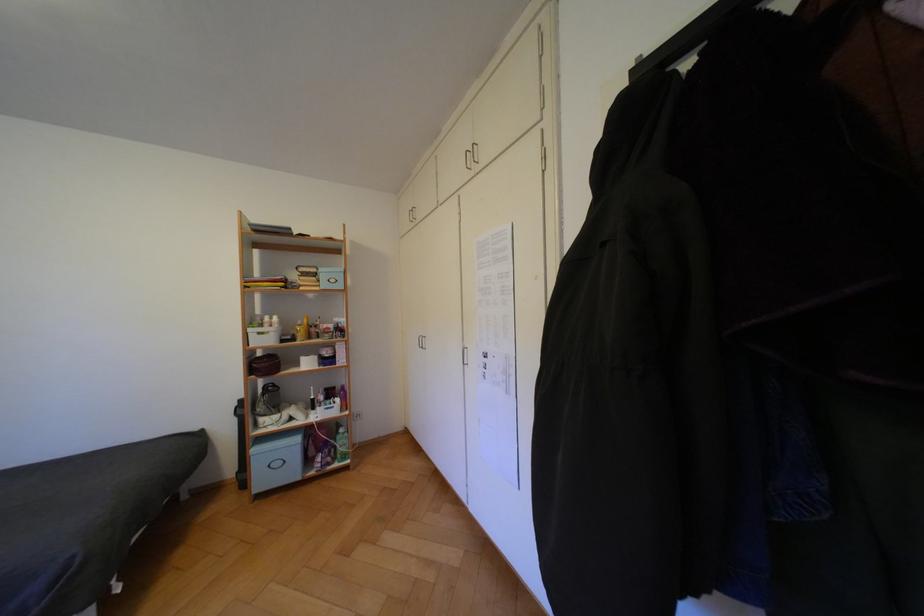
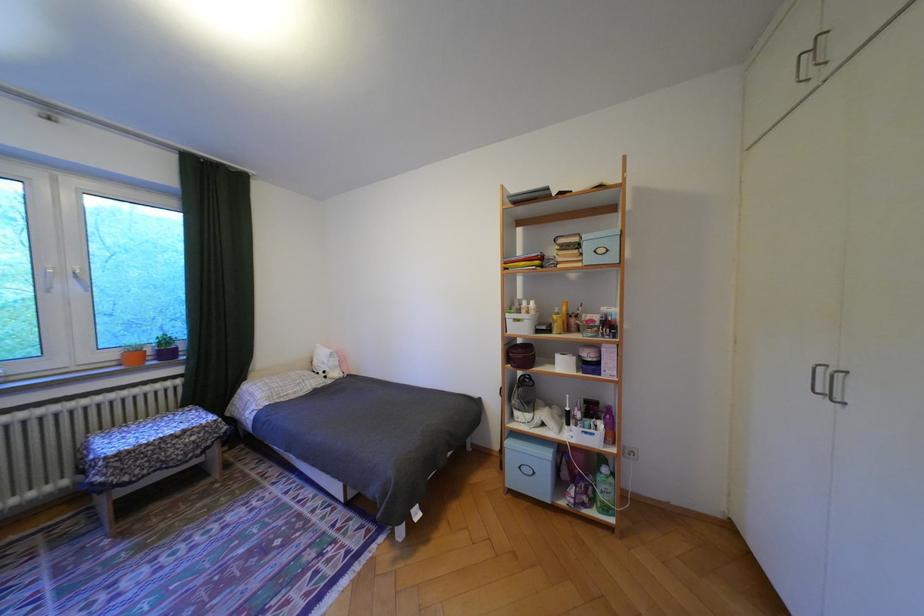
Find the pixel in the second image that matches [275,363] in the first image.

(531, 355)